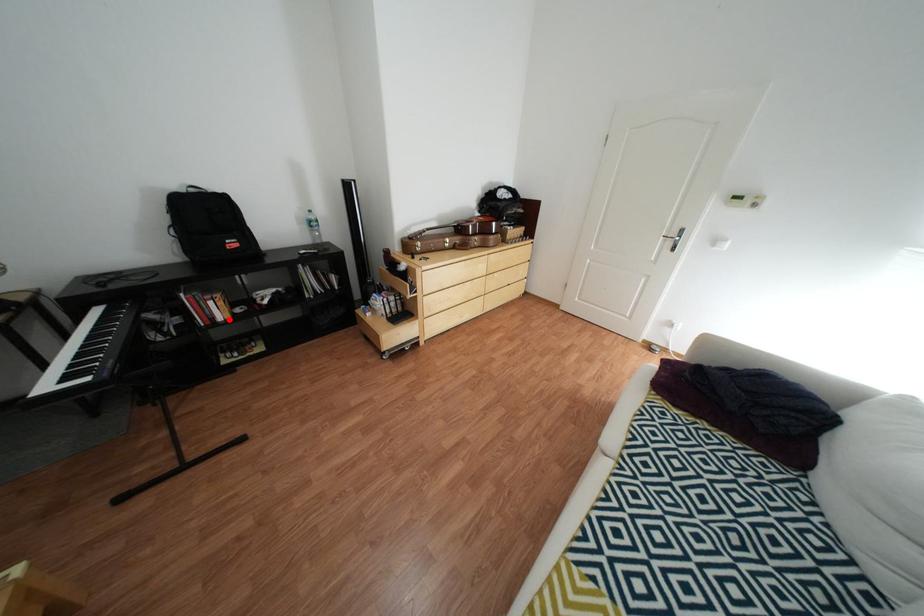
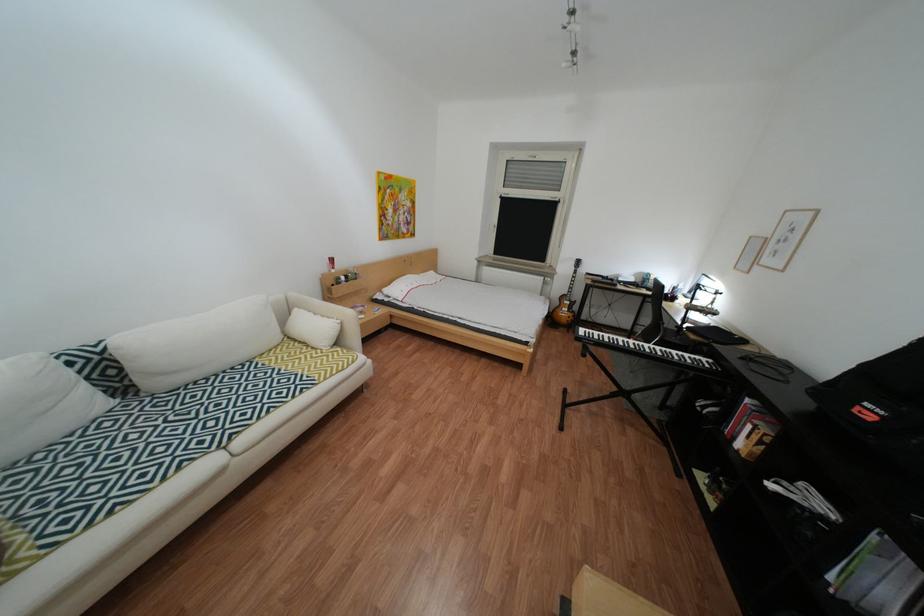
Locate, in the second image, the point that corresponds to the highlighted location in the first image.

(749, 439)